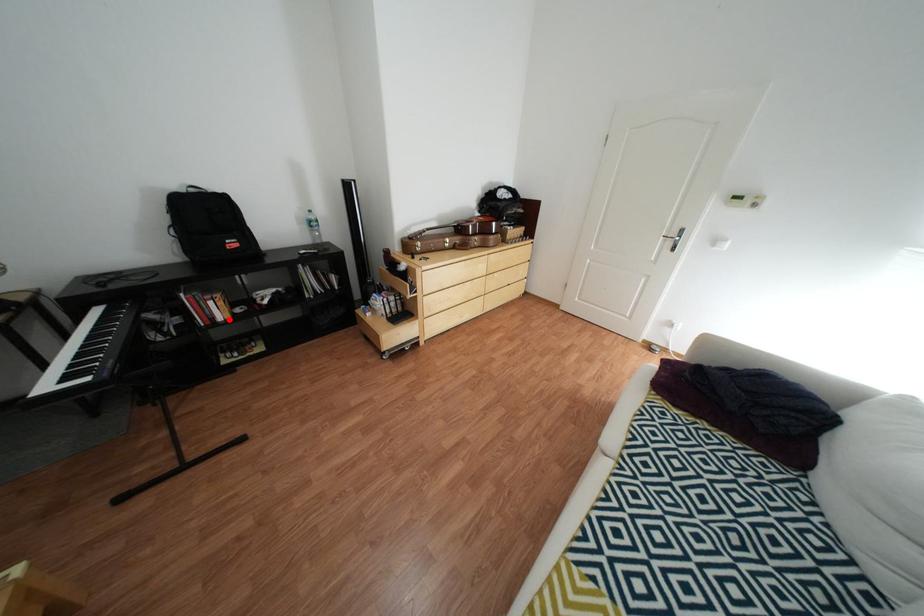
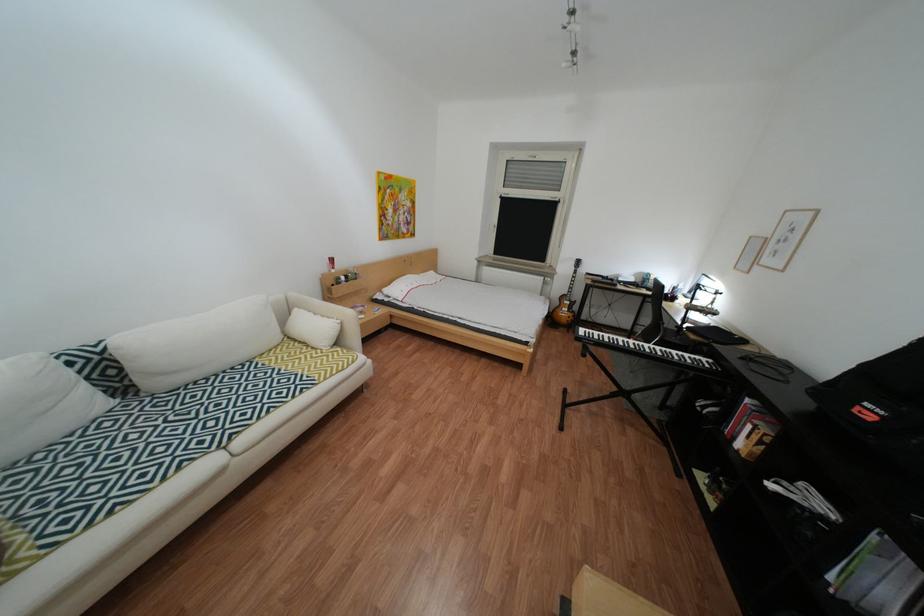
Locate, in the second image, the point that corresponds to the highlighted location in the first image.

(749, 439)